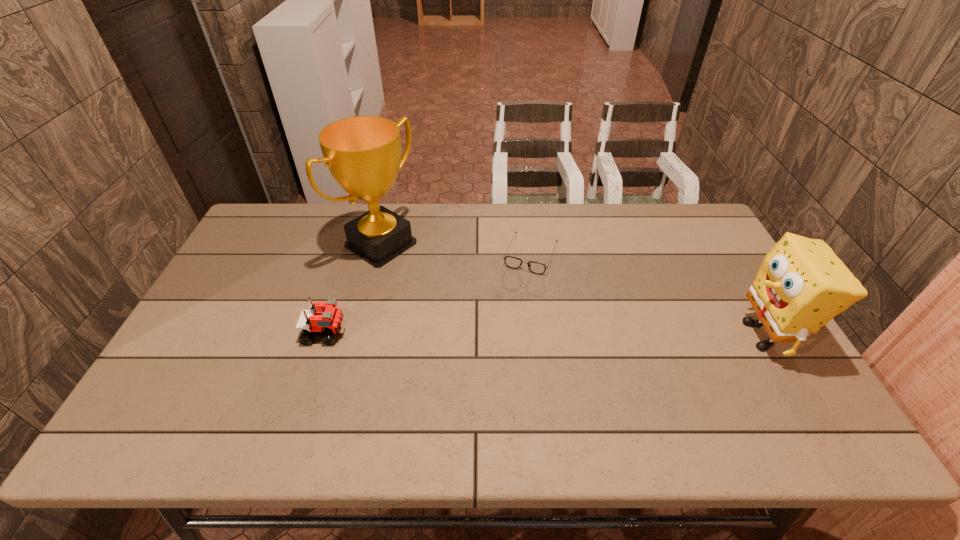
You are a GUI agent. You are given a task and a screenshot of the screen. Output one action in this format:
    pyautogui.click(x=<x>, y=<y>)
    Task: Click on the Lego
    This screenshot has height=540, width=960.
    Given the screenshot: What is the action you would take?
    pyautogui.click(x=328, y=320)

Where is `the rightmost object`? This screenshot has width=960, height=540. the rightmost object is located at coordinates (801, 284).

Identify the location of sponge. (801, 284).

Locate an element on the screen. This screenshot has width=960, height=540. sunglasses is located at coordinates (512, 262).

The height and width of the screenshot is (540, 960). I want to click on the third object from left to right, so click(x=512, y=262).

The height and width of the screenshot is (540, 960). I want to click on the tallest object, so [x=363, y=153].

Locate an element on the screen. This screenshot has width=960, height=540. blank area located on the front-facing side of the Lego is located at coordinates (401, 333).

The width and height of the screenshot is (960, 540). Identify the location of free spot located on the face of the second tallest object. [673, 335].

The width and height of the screenshot is (960, 540). What are the coordinates of `vacant point located on the face of the second tallest object` in the screenshot? It's located at (707, 335).

In order to click on vacant region located on the face of the second tallest object in this screenshot , I will do `click(700, 335)`.